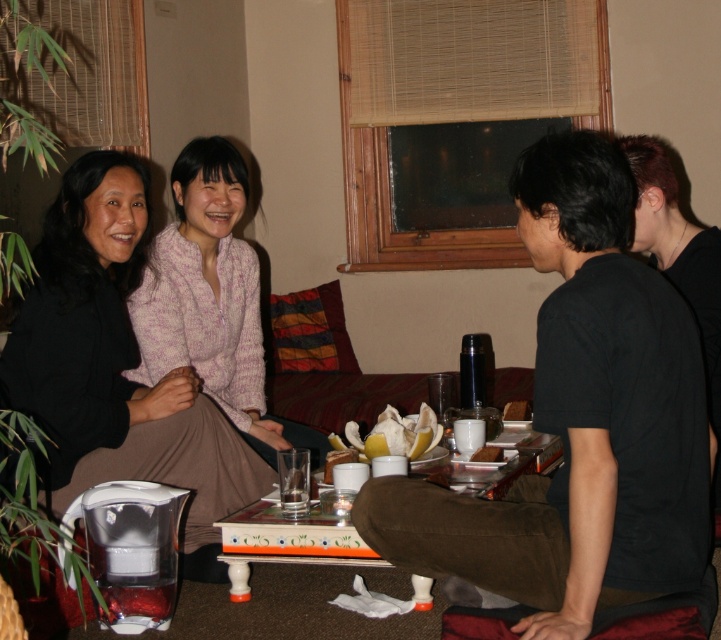
Question: Among these objects, which one is farthest from the camera?

Choices:
 (A) black cotton shirt at right
 (B) black matte shirt at right
 (C) light pink knitted sweater at center

Answer: (C)

Question: Can you confirm if light pink knitted sweater at center is positioned to the left of clear glass at center?

Choices:
 (A) no
 (B) yes

Answer: (B)

Question: Is black matte shirt at right smaller than wooden painted table at center?

Choices:
 (A) yes
 (B) no

Answer: (B)

Question: Does knitted sweater at center come in front of black matte shirt at right?

Choices:
 (A) yes
 (B) no

Answer: (B)

Question: Which of the following is the closest to the observer?

Choices:
 (A) (230, 552)
 (B) (544, 522)

Answer: (B)

Question: Which point is farther to the camera?

Choices:
 (A) click(x=265, y=547)
 (B) click(x=309, y=508)
 (C) click(x=213, y=324)

Answer: (C)